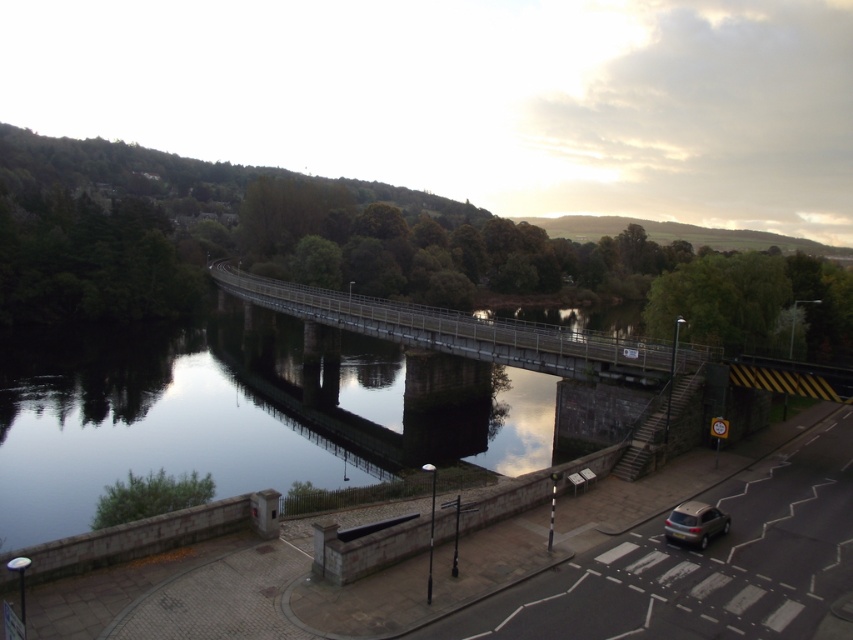
Question: Is reflective concrete water at center to the right of satin silver car at lower right from the viewer's perspective?

Choices:
 (A) no
 (B) yes

Answer: (A)

Question: Can you confirm if reflective concrete water at center is positioned to the left of metallic gray bridge at center?

Choices:
 (A) no
 (B) yes

Answer: (A)

Question: Considering the real-world distances, which object is farthest from the reflective concrete water at center?

Choices:
 (A) satin silver car at lower right
 (B) metallic gray bridge at center

Answer: (A)

Question: Is reflective concrete water at center to the left of satin silver car at lower right from the viewer's perspective?

Choices:
 (A) no
 (B) yes

Answer: (B)

Question: Among these points, which one is nearest to the camera?

Choices:
 (A) (227, 282)
 (B) (726, 531)

Answer: (B)

Question: Among these points, which one is farthest from the camera?

Choices:
 (A) (709, 522)
 (B) (289, 378)
 (C) (392, 316)

Answer: (B)